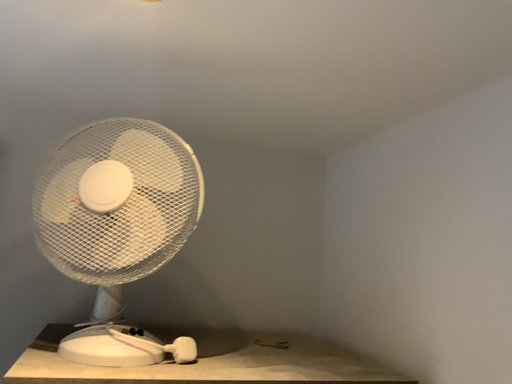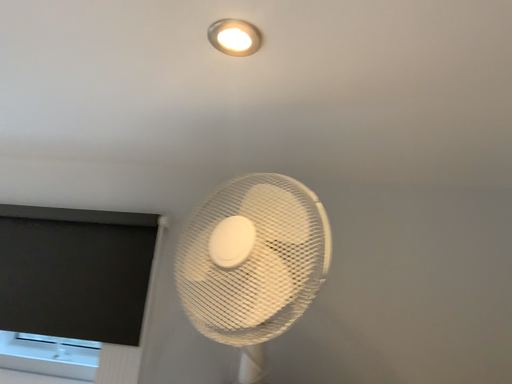
Question: How did the camera likely rotate when shooting the video?

Choices:
 (A) rotated left
 (B) rotated right

Answer: (A)